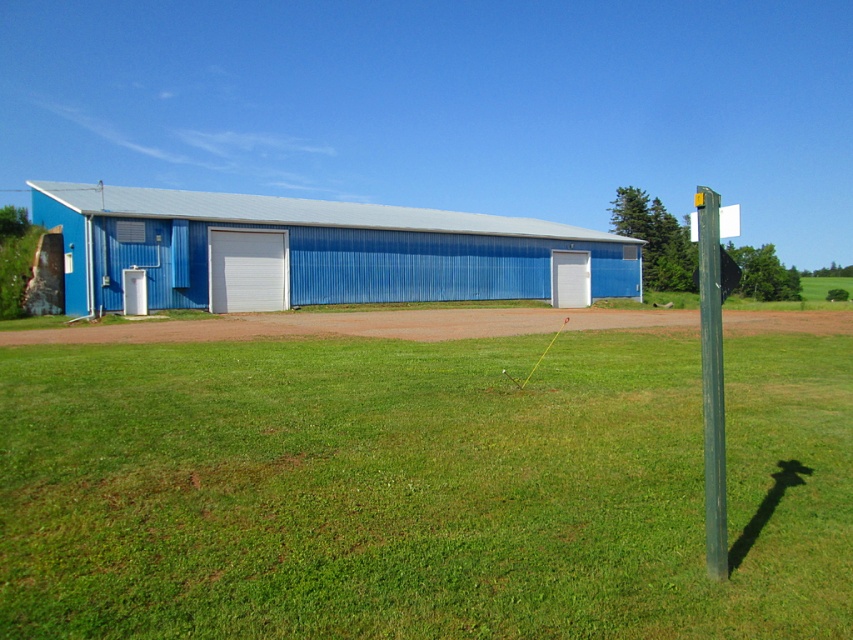
Who is positioned more to the left, white smooth garage door at center or white matte garage door at center?

white smooth garage door at center

Locate an element on the screen. white smooth garage door at center is located at coordinates (247, 269).

Where is `white smooth garage door at center`? The height and width of the screenshot is (640, 853). white smooth garage door at center is located at coordinates (247, 269).

Identify the location of white smooth garage door at center. (247, 269).

Which is above, blue corrugated metal hangar at center or white smooth garage door at center?

blue corrugated metal hangar at center

Is point (148, 296) positioned before point (241, 262)?

Yes, it is in front of point (241, 262).

Which is in front, point (373, 278) or point (242, 237)?

Positioned in front is point (242, 237).

The height and width of the screenshot is (640, 853). In order to click on blue corrugated metal hangar at center in this screenshot , I will do `click(308, 250)`.

Who is taller, blue corrugated metal hangar at center or green metallic pole at right?

green metallic pole at right

Is point (181, 292) positioned before point (709, 388)?

No.

Image resolution: width=853 pixels, height=640 pixels. I want to click on blue corrugated metal hangar at center, so click(308, 250).